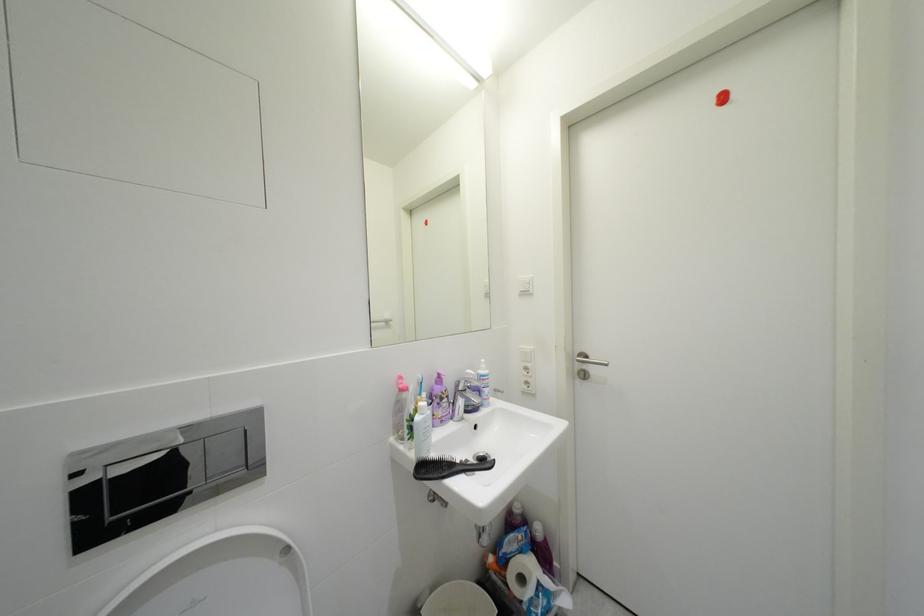
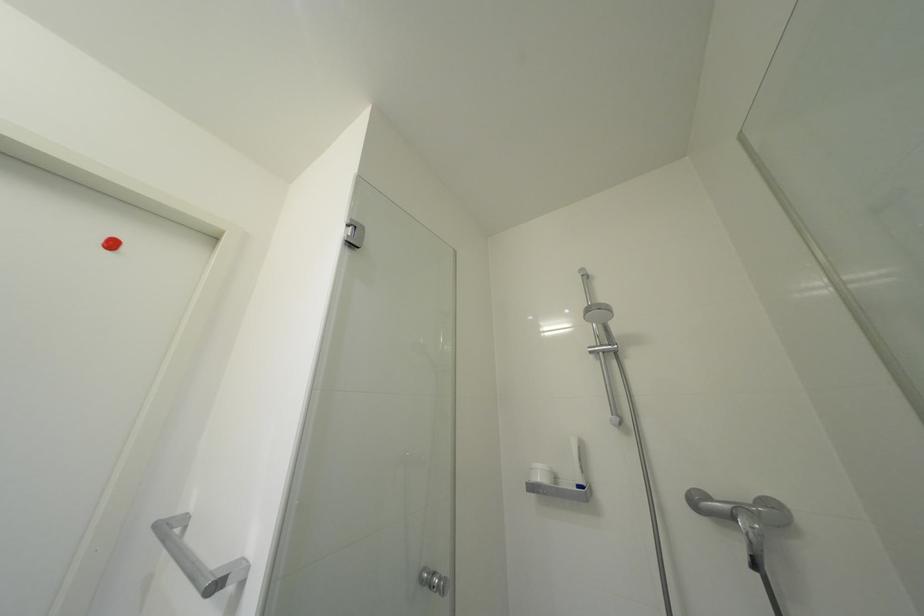
How did the camera likely rotate?

The camera rotated toward right-up.